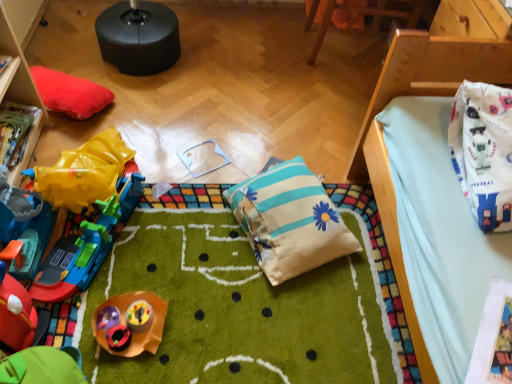
Question: In terms of height, does striped cotton pillow at center look taller or shorter compared to rubberized green toy car at lower left, the second toy viewed from the top?

Choices:
 (A) tall
 (B) short

Answer: (B)

Question: Looking at their shapes, would you say striped cotton pillow at center is wider or thinner than rubberized green toy car at lower left, which ranks as the 2th toy in bottom-to-top order?

Choices:
 (A) wide
 (B) thin

Answer: (A)

Question: Considering the real-world distances, which object is farthest from the wooden toy train at left, marked as the 3th furniture in a right-to-left arrangement?

Choices:
 (A) white fabric bag at upper right
 (B) wooden chair at upper center, the 2th furniture positioned from the left
 (C) plastic toy at center, arranged as the first toy when ordered from the bottom
 (D) rubberized green toy car at lower left, which ranks as the 2th toy in bottom-to-top order
 (E) white fabric at upper right, positioned as the 3th furniture in left-to-right order

Answer: (B)

Question: Which is farther from the white fabric bag at upper right?

Choices:
 (A) white fabric at upper right, positioned as the 3th furniture in left-to-right order
 (B) wooden chair at upper center, acting as the second furniture starting from the right
 (C) plastic toy at center, arranged as the first toy when ordered from the bottom
 (D) wooden toy train at left, which appears as the 1th furniture when viewed from the left
 (E) rubberized green toy car at lower left, the second toy viewed from the top

Answer: (D)